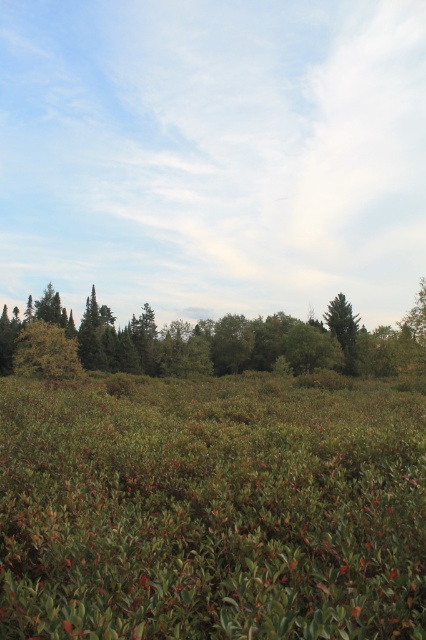
Question: From the image, what is the correct spatial relationship of green matte grass at center in relation to green matte tree at center?

Choices:
 (A) right
 (B) left

Answer: (B)

Question: Which point is farther to the camera?

Choices:
 (A) green matte tree at center
 (B) green matte grass at center

Answer: (A)

Question: Which point is farther from the camera taking this photo?

Choices:
 (A) (80, 499)
 (B) (264, 340)

Answer: (B)

Question: Is green matte grass at center above green matte tree at center?

Choices:
 (A) yes
 (B) no

Answer: (B)

Question: Which of the following is the farthest from the observer?

Choices:
 (A) green matte grass at center
 (B) green matte tree at center

Answer: (B)

Question: Does green matte grass at center have a lesser width compared to green matte tree at center?

Choices:
 (A) yes
 (B) no

Answer: (A)